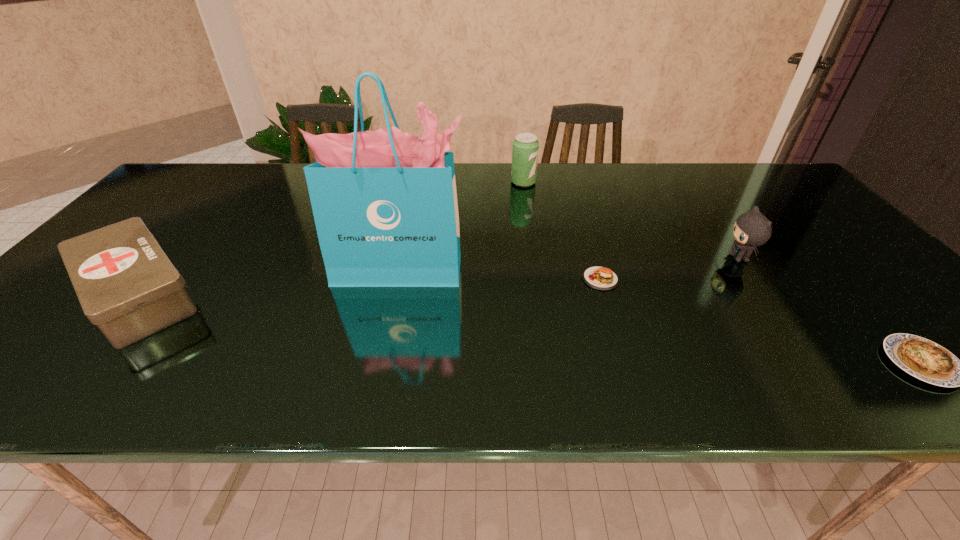
This screenshot has height=540, width=960. Find the location of `free space that satisfies the following two spatial constraints: 1. on the front-facing side of the kitten; 2. on the front side of the leftmost object`. free space that satisfies the following two spatial constraints: 1. on the front-facing side of the kitten; 2. on the front side of the leftmost object is located at coordinates (764, 294).